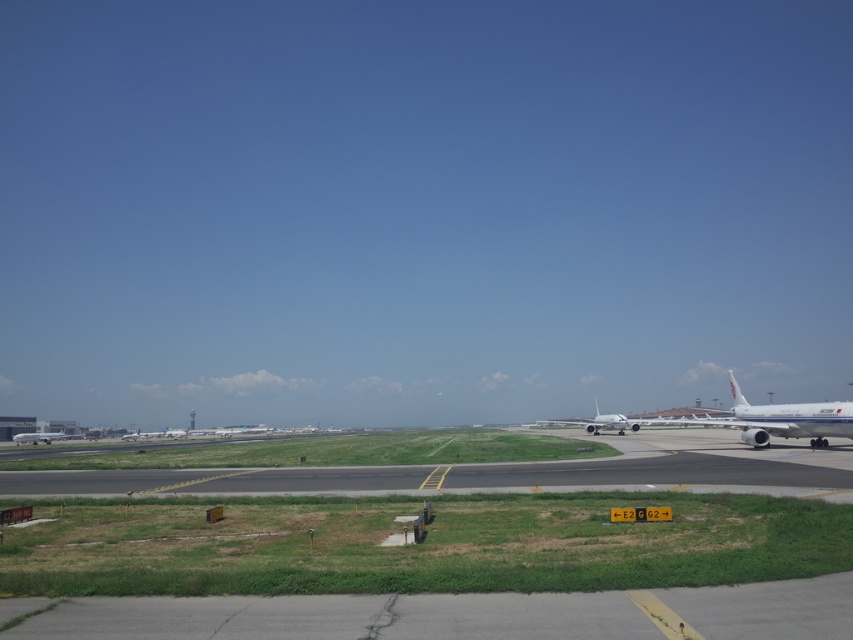
Can you confirm if black asphalt runway at center is bigger than metallic silver airplane at lower left?

Actually, black asphalt runway at center might be smaller than metallic silver airplane at lower left.

Where is `black asphalt runway at center`? black asphalt runway at center is located at coordinates (648, 472).

Locate an element on the screen. The width and height of the screenshot is (853, 640). black asphalt runway at center is located at coordinates (648, 472).

Does white glossy airplane at right have a lesser width compared to metallic silver airplane at center?

Incorrect, white glossy airplane at right's width is not less than metallic silver airplane at center's.

Who is more forward, (730, 424) or (595, 433)?

Point (730, 424) is more forward.

In order to click on white glossy airplane at right in this screenshot , I will do `click(786, 419)`.

Can you confirm if metallic silver airplane at center is positioned to the right of metallic silver airplane at lower left?

Correct, you'll find metallic silver airplane at center to the right of metallic silver airplane at lower left.

Who is more forward, [564,426] or [44,440]?

Point [44,440] is more forward.

Between point (606, 417) and point (77, 435), which one is positioned in front?

Point (606, 417)

You are a GUI agent. You are given a task and a screenshot of the screen. Output one action in this format:
    pyautogui.click(x=<x>, y=<y>)
    Task: Click on the metallic silver airplane at center
    This screenshot has height=640, width=853.
    Given the screenshot: What is the action you would take?
    pyautogui.click(x=601, y=422)